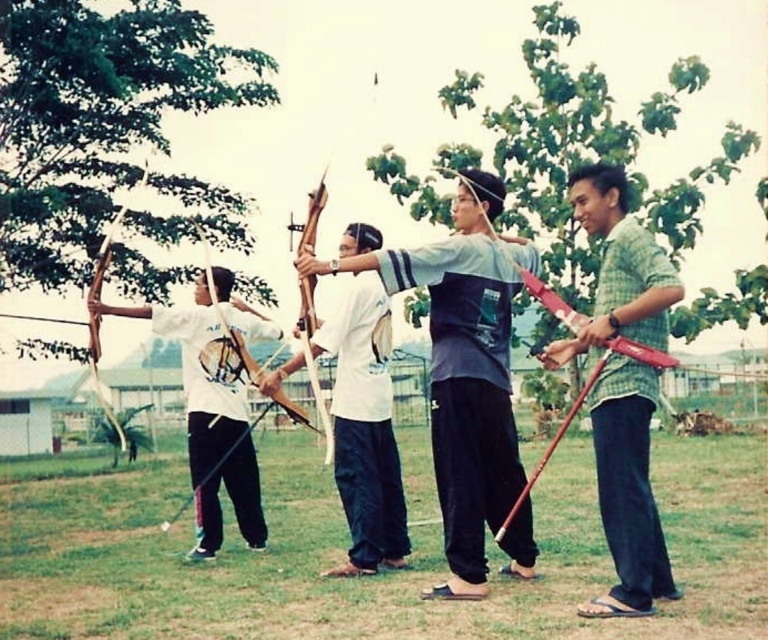
Can you confirm if matte gray shirt at center is shorter than white matte bow at center?

In fact, matte gray shirt at center may be taller than white matte bow at center.

Does point (500, 280) lie behind point (392, 552)?

No, (500, 280) is closer to viewer.

The height and width of the screenshot is (640, 768). I want to click on matte gray shirt at center, so click(464, 369).

Is point (624, 244) less distant than point (267, 330)?

That is True.

Find the location of a particular element. green checkered shirt at right is located at coordinates pos(627,490).

The width and height of the screenshot is (768, 640). I want to click on green checkered shirt at right, so click(x=627, y=490).

Is point (435, 272) farther from camera compared to point (147, 161)?

No, (435, 272) is closer to viewer.

Between point (469, 300) and point (94, 300), which one is positioned behind?

The point (94, 300) is behind.

In order to click on matte gray shirt at center in this screenshot , I will do `click(464, 369)`.